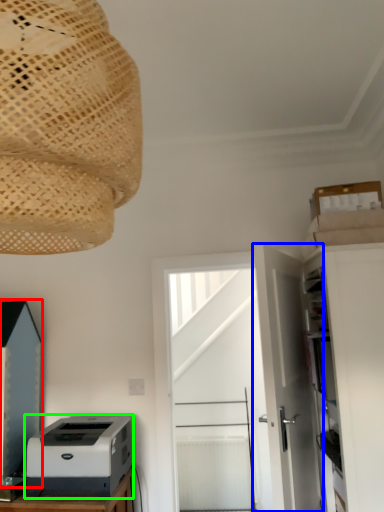
Question: Considering the real-world distances, which object is closest to cabinetry (highlighted by a red box)? door (highlighted by a blue box) or printer (highlighted by a green box).

Choices:
 (A) door
 (B) printer

Answer: (B)